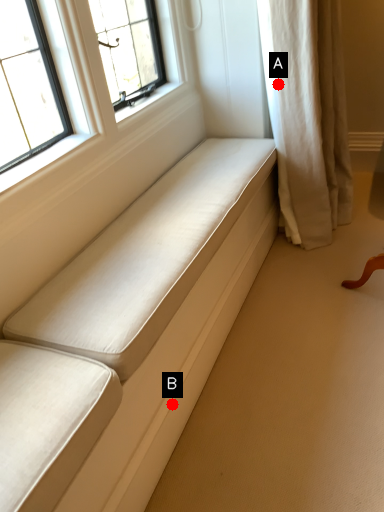
Question: Two points are circled on the image, labeled by A and B beside each circle. Which point is closer to the camera taking this photo?

Choices:
 (A) A is closer
 (B) B is closer

Answer: (B)